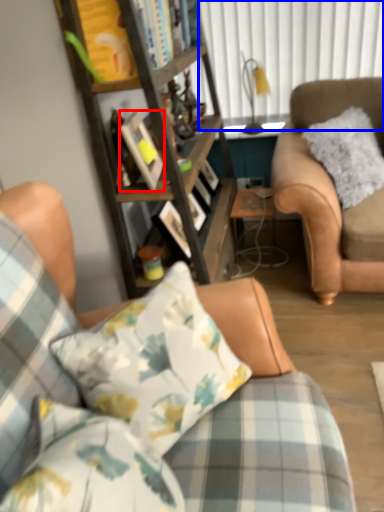
Question: Which object appears closest to the camera in this image, picture frame (highlighted by a red box) or window screen (highlighted by a blue box)?

Choices:
 (A) picture frame
 (B) window screen

Answer: (A)